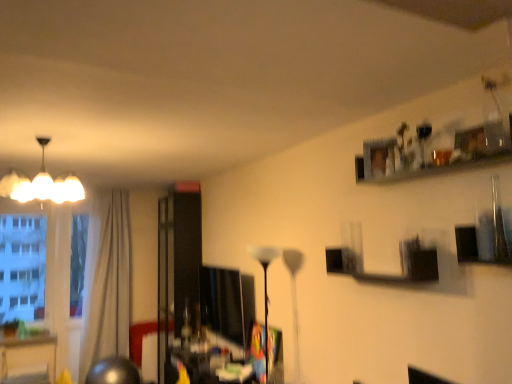
Question: Can you confirm if white glossy chandelier at upper left, the 1th lamp in the left-to-right sequence, is taller than matte black monitor at center?

Choices:
 (A) no
 (B) yes

Answer: (A)

Question: From the image's perspective, is white glossy chandelier at upper left, the first lamp when ordered from top to bottom, on matte black monitor at center?

Choices:
 (A) no
 (B) yes

Answer: (B)

Question: Can you confirm if white glossy chandelier at upper left, the 1th lamp in the left-to-right sequence, is bigger than matte black monitor at center?

Choices:
 (A) yes
 (B) no

Answer: (A)

Question: Could you tell me if white glossy chandelier at upper left, the 1th lamp in the left-to-right sequence, is turned towards matte black monitor at center?

Choices:
 (A) yes
 (B) no

Answer: (B)

Question: From a real-world perspective, is white glossy chandelier at upper left, the second lamp ordered from the bottom, under matte black monitor at center?

Choices:
 (A) no
 (B) yes

Answer: (A)

Question: From their relative heights in the image, would you say white glossy chandelier at upper left, the second lamp from the right, is taller or shorter than beige fabric curtain at left?

Choices:
 (A) tall
 (B) short

Answer: (B)

Question: Does point (54, 183) appear closer or farther from the camera than point (112, 292)?

Choices:
 (A) farther
 (B) closer

Answer: (B)

Question: Is white glossy chandelier at upper left, the first lamp when ordered from top to bottom, bigger or smaller than beige fabric curtain at left?

Choices:
 (A) big
 (B) small

Answer: (B)

Question: Considering the positions of white glossy chandelier at upper left, the first lamp when ordered from top to bottom, and beige fabric curtain at left in the image, is white glossy chandelier at upper left, the first lamp when ordered from top to bottom, wider or thinner than beige fabric curtain at left?

Choices:
 (A) thin
 (B) wide

Answer: (B)

Question: From the image's perspective, is white glossy chandelier at upper left, the first lamp when ordered from top to bottom, located above or below white glossy floor lamp at center, placed as the 1th lamp when sorted from right to left?

Choices:
 (A) below
 (B) above

Answer: (B)

Question: Do you think white glossy chandelier at upper left, the second lamp ordered from the bottom, is within white glossy floor lamp at center, which ranks as the first lamp in bottom-to-top order, or outside of it?

Choices:
 (A) outside
 (B) inside

Answer: (A)

Question: Based on their sizes in the image, would you say white glossy chandelier at upper left, the first lamp when ordered from top to bottom, is bigger or smaller than white glossy floor lamp at center, placed as the 1th lamp when sorted from right to left?

Choices:
 (A) small
 (B) big

Answer: (B)

Question: Relative to white glossy floor lamp at center, placed as the 1th lamp when sorted from right to left, is white glossy chandelier at upper left, the first lamp when ordered from top to bottom, in front or behind?

Choices:
 (A) behind
 (B) front

Answer: (B)

Question: From a real-world perspective, is transparent glass window at left positioned above or below white glossy chandelier at upper left, the 1th lamp in the left-to-right sequence?

Choices:
 (A) above
 (B) below

Answer: (B)

Question: Would you say transparent glass window at left is to the left or to the right of white glossy chandelier at upper left, the 1th lamp in the left-to-right sequence, in the picture?

Choices:
 (A) right
 (B) left

Answer: (B)